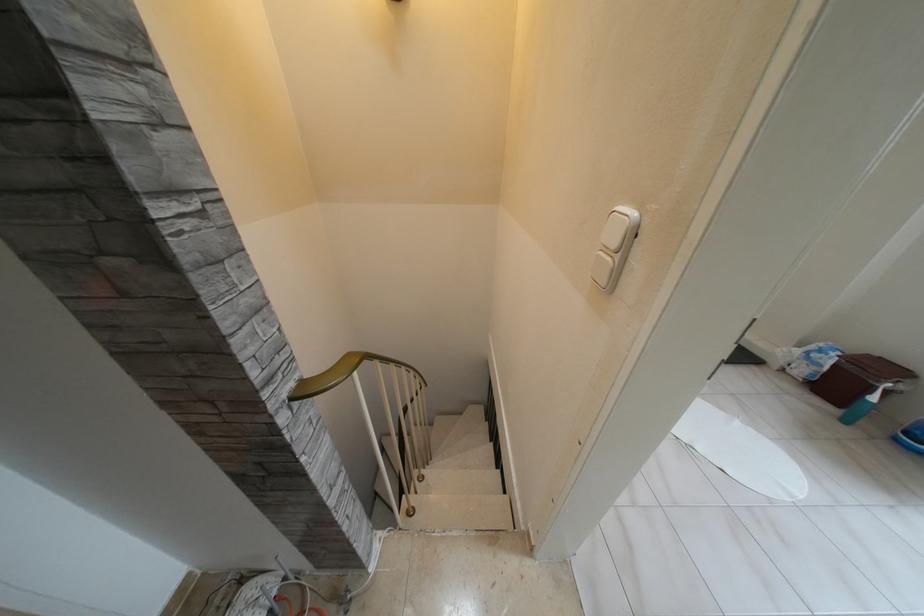
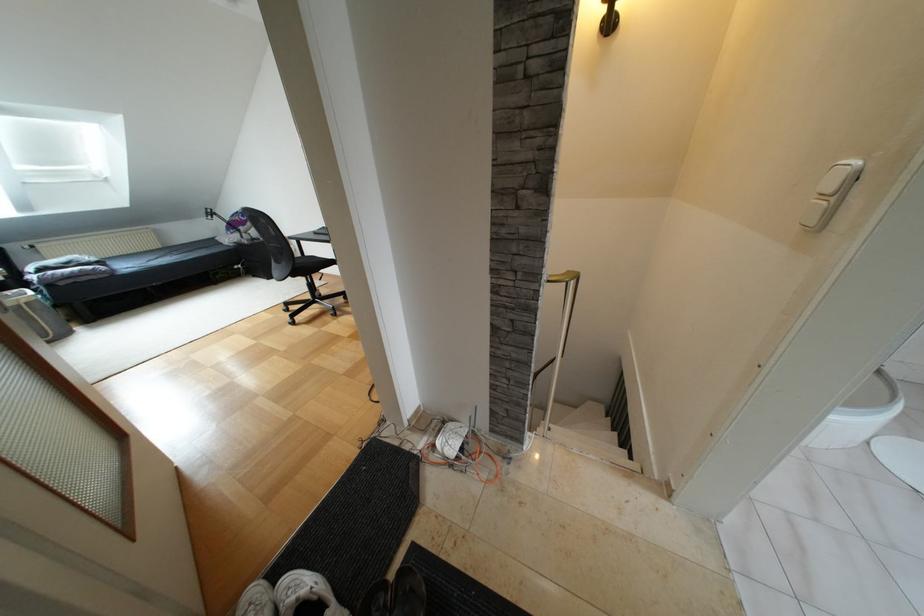
In the second image, find the point that corresponds to [497,471] in the first image.

(624, 451)